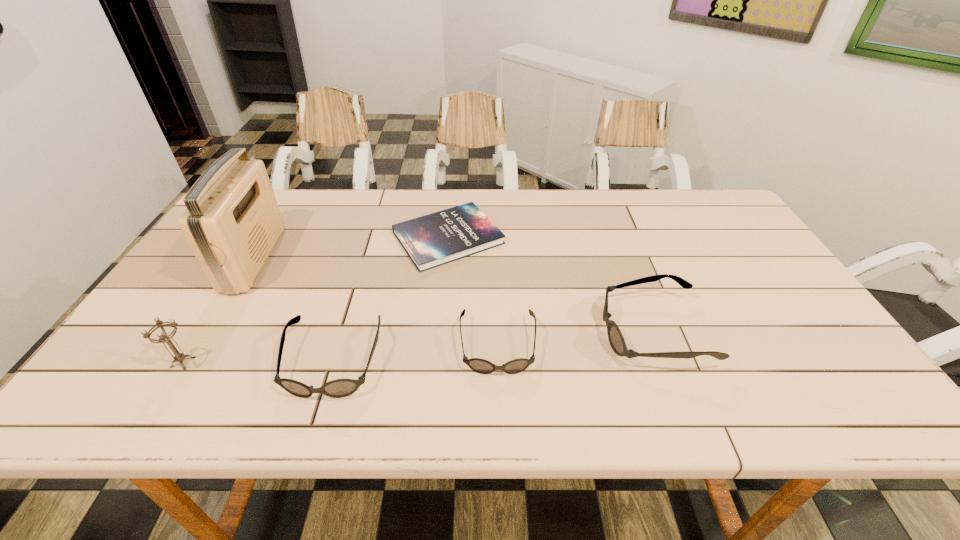
The width and height of the screenshot is (960, 540). Identify the location of unoccupied area between the leftmost sunglasses and the fifth tallest object. (416, 354).

The height and width of the screenshot is (540, 960). I want to click on vacant space in between the rightmost sunglasses and the candle holder, so click(x=418, y=347).

The image size is (960, 540). Identify the location of free spot between the fifth shortest object and the shortest object. (316, 300).

This screenshot has height=540, width=960. Identify the location of free space between the rightmost object and the fifth tallest object. (575, 339).

Identify the location of free space that is in between the tallest object and the shortest object. The height and width of the screenshot is (540, 960). (351, 248).

I want to click on vacant region between the fifth tallest object and the second shortest sunglasses, so click(x=416, y=354).

Choose which object is the nearest neighbor to the second tallest sunglasses. Please provide its 2D coordinates. Your answer should be formatted as a tuple, i.e. [(x, y)], where the tuple contains the x and y coordinates of a point satisfying the conditions above.

[(482, 366)]

Locate an element on the screen. Image resolution: width=960 pixels, height=540 pixels. object that stands as the fifth closest to the candle holder is located at coordinates (616, 339).

This screenshot has height=540, width=960. In order to click on sunglasses that is the closest to the second tallest object in this screenshot , I will do `click(339, 388)`.

Locate an element on the screen. The height and width of the screenshot is (540, 960). sunglasses object that ranks as the closest to the hardback book is located at coordinates (482, 366).